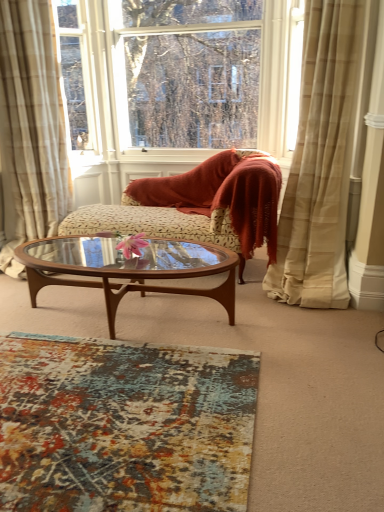
Question: Is velvet beige chaise at center taller or shorter than beige plaid curtain at left, positioned as the 1th curtain in left-to-right order?

Choices:
 (A) short
 (B) tall

Answer: (A)

Question: Looking at the image, does velvet beige chaise at center seem bigger or smaller compared to beige plaid curtain at left, positioned as the 1th curtain in left-to-right order?

Choices:
 (A) big
 (B) small

Answer: (A)

Question: Estimate the real-world distances between objects in this image. Which object is farther from the velvet beige chaise at center?

Choices:
 (A) brown wood/glass coffee table at center
 (B) beige plaid curtain at right, marked as the second curtain in a left-to-right arrangement
 (C) beige plaid curtain at left, positioned as the 1th curtain in left-to-right order
 (D) transparent glass window at upper center
 (E) textured multicolored rug at lower left

Answer: (E)

Question: Estimate the real-world distances between objects in this image. Which object is closer to the beige plaid curtain at right, marked as the second curtain in a left-to-right arrangement?

Choices:
 (A) transparent glass window at upper center
 (B) velvet beige chaise at center
 (C) textured multicolored rug at lower left
 (D) beige plaid curtain at left, positioned as the 1th curtain in left-to-right order
 (E) brown wood/glass coffee table at center

Answer: (B)